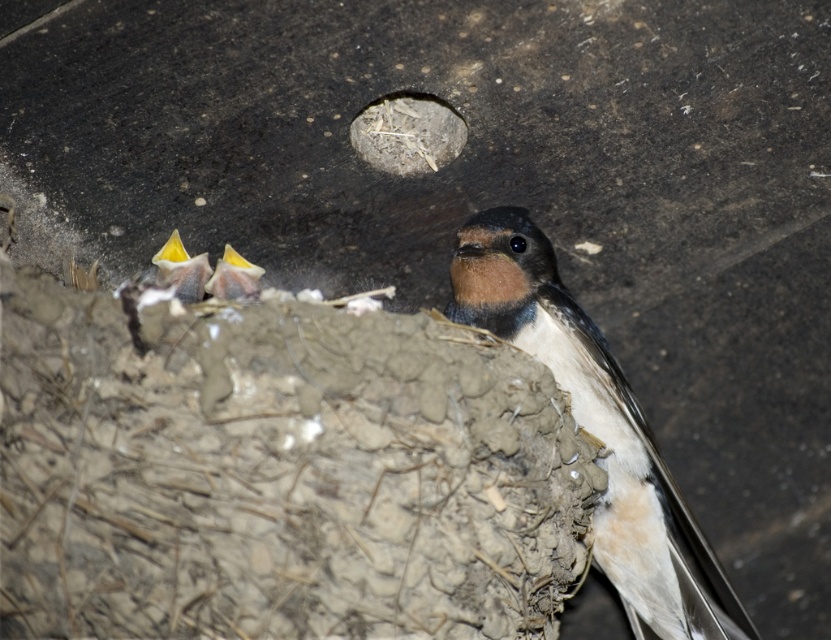
Question: Which of the following is the closest to the observer?

Choices:
 (A) yellow beak at center
 (B) brown feathered bird at center
 (C) yellow beak at left

Answer: (C)

Question: Is brown feathered bird at center in front of yellow beak at left?

Choices:
 (A) no
 (B) yes

Answer: (A)

Question: Is the position of brown feathered bird at center less distant than that of yellow beak at center?

Choices:
 (A) yes
 (B) no

Answer: (B)

Question: Is brown feathered bird at center in front of yellow beak at left?

Choices:
 (A) no
 (B) yes

Answer: (A)

Question: Which point appears farthest from the camera in this image?

Choices:
 (A) (180, 282)
 (B) (628, 406)

Answer: (B)

Question: Which point is closer to the camera?

Choices:
 (A) (205, 264)
 (B) (574, 384)
 (C) (243, 292)

Answer: (C)